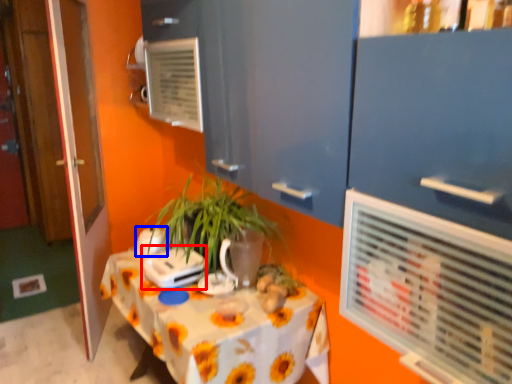
Question: Which of the following is the farthest to the observer, appliance (highlighted by a red box) or appliance (highlighted by a blue box)?

Choices:
 (A) appliance
 (B) appliance

Answer: (B)